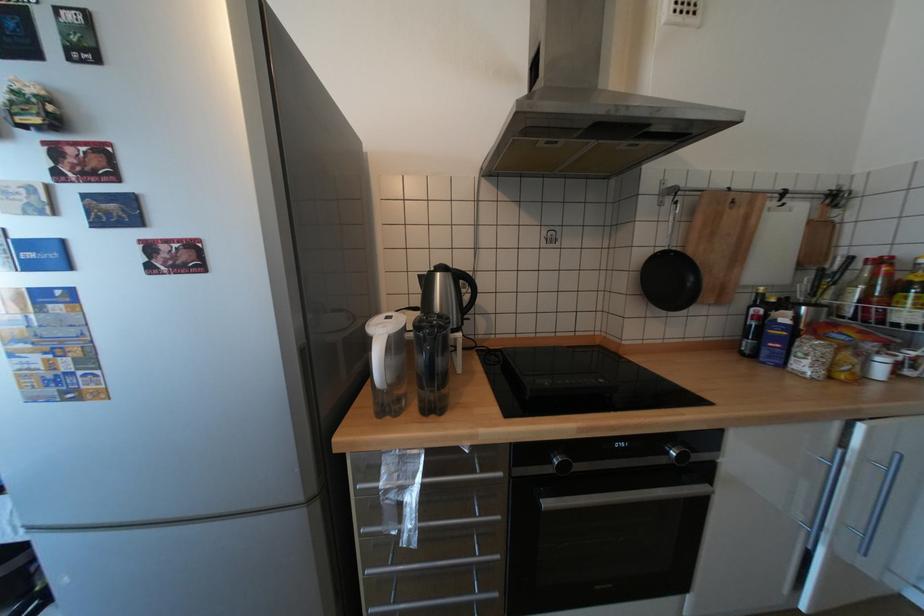
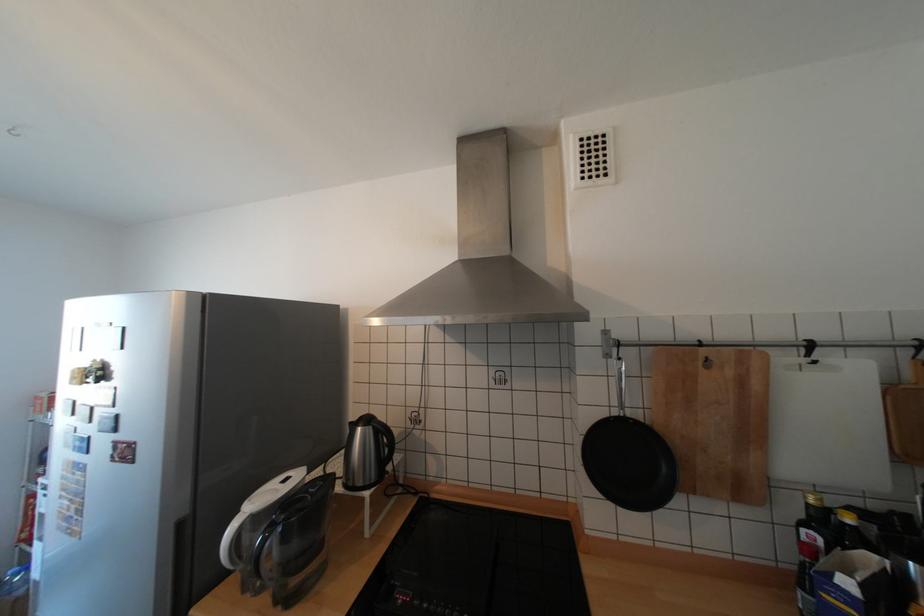
Where in the second image is the point corresponding to the point at 793,205 from the first image?

(823, 362)